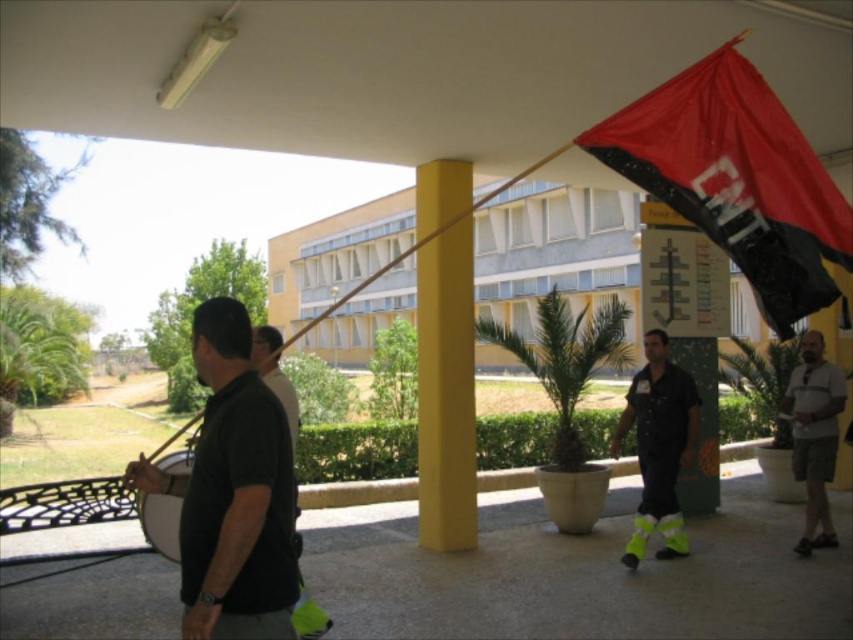
Question: Does black matte flag at upper right appear over yellow matte pillar at center?

Choices:
 (A) no
 (B) yes

Answer: (B)

Question: Does black matte shirt at left have a smaller size compared to neon yellow reflective pants at center?

Choices:
 (A) yes
 (B) no

Answer: (A)

Question: Does yellow matte column at center have a greater width compared to neon yellow reflective pants at center?

Choices:
 (A) no
 (B) yes

Answer: (A)

Question: Among these points, which one is nearest to the camera?

Choices:
 (A) (206, 548)
 (B) (828, 460)
 (C) (448, 522)
 (D) (688, 440)

Answer: (A)

Question: Which object appears farthest from the camera in this image?

Choices:
 (A) neon yellow reflective pants at center
 (B) white cotton t-shirt at center
 (C) black matte flag at upper right

Answer: (B)

Question: Which object is positioned farthest from the yellow matte pillar at center?

Choices:
 (A) black matte shirt at left
 (B) white cotton t-shirt at center
 (C) yellow matte column at center
 (D) neon yellow reflective pants at center

Answer: (A)